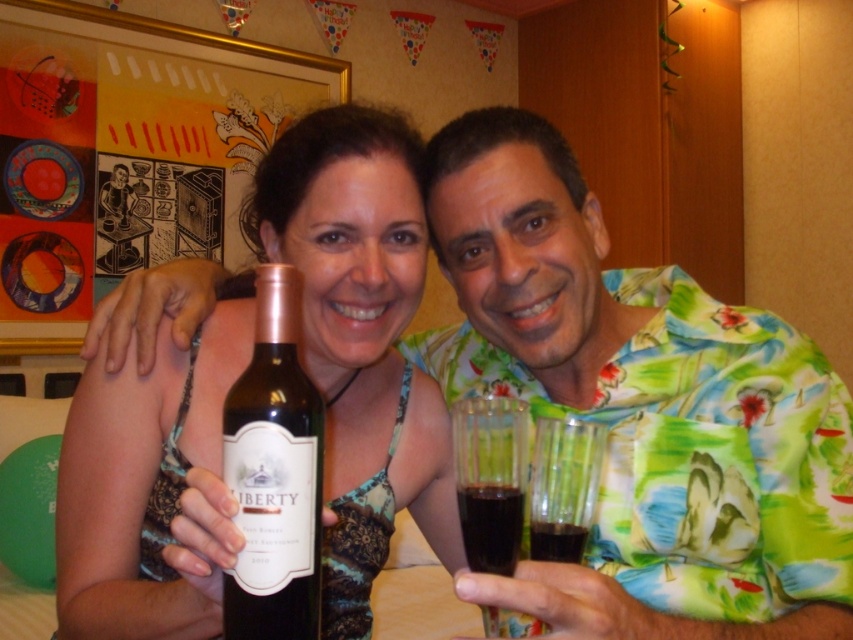
Question: Which object is farther from the camera taking this photo?

Choices:
 (A) dark brown glass at lower center
 (B) transparent plastic glass at lower center
 (C) transparent plastic wine glass at lower center

Answer: (A)

Question: Observing the image, what is the correct spatial positioning of matte glass bottle at center in reference to dark red liquid at center?

Choices:
 (A) left
 (B) right

Answer: (A)

Question: Which object is farther from the camera taking this photo?

Choices:
 (A) transparent plastic glass at lower center
 (B) dark red liquid at center

Answer: (B)

Question: Can you confirm if matte glass bottle at center is positioned to the left of transparent plastic wine glass at lower center?

Choices:
 (A) yes
 (B) no

Answer: (A)

Question: Which is farther from the dark red liquid at center?

Choices:
 (A) transparent plastic glass at lower center
 (B) matte green dress at center

Answer: (B)

Question: Is matte green dress at center positioned behind dark brown glass at lower center?

Choices:
 (A) no
 (B) yes

Answer: (A)